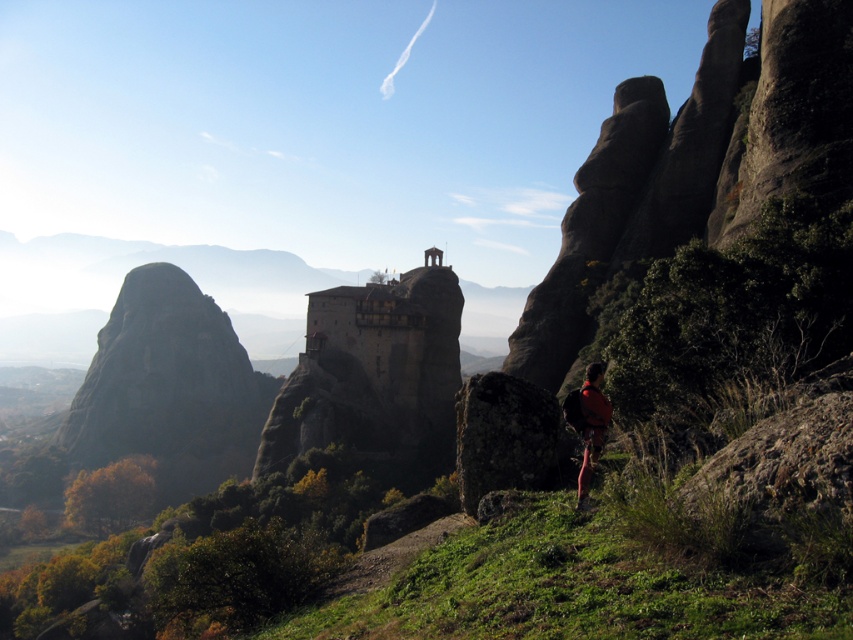
Question: Which point is closer to the camera?

Choices:
 (A) (587, 385)
 (B) (482, 413)

Answer: (A)

Question: Which point is farther to the camera?

Choices:
 (A) (596, 422)
 (B) (289, 417)
 (C) (492, 429)

Answer: (B)

Question: Which is nearer to the orange fabric backpack at lower right?

Choices:
 (A) rough textured rock at center
 (B) stone building at center

Answer: (A)

Question: Where is stone building at center located in relation to orange fabric backpack at lower right in the image?

Choices:
 (A) left
 (B) right

Answer: (A)

Question: Can you confirm if stone building at center is positioned above orange fabric backpack at lower right?

Choices:
 (A) yes
 (B) no

Answer: (B)

Question: Does rough textured rock at center have a greater width compared to orange fabric backpack at lower right?

Choices:
 (A) no
 (B) yes

Answer: (B)